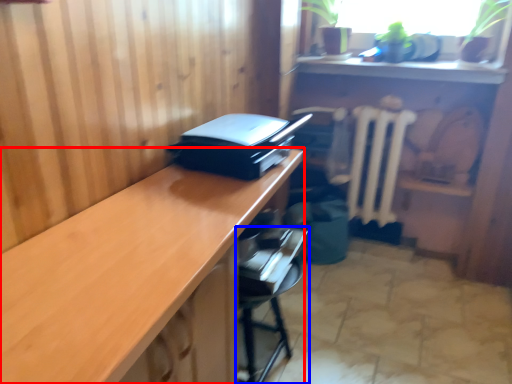
Question: Which object is further to the camera taking this photo, desk (highlighted by a red box) or furniture (highlighted by a blue box)?

Choices:
 (A) desk
 (B) furniture

Answer: (B)